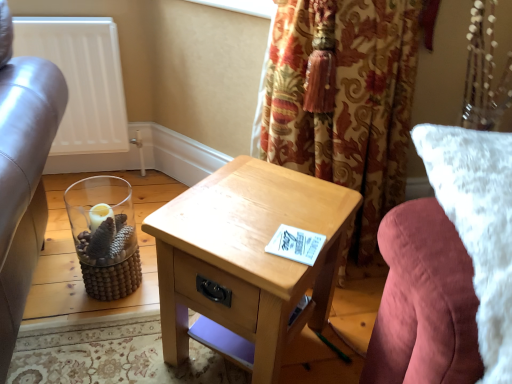
What are the coordinates of `clear glass vase at lower left` in the screenshot? It's located at (104, 235).

Identify the location of white matte radiator at upper left. (81, 79).

Find the location of a particular element. light wood/texture nightstand at center is located at coordinates (247, 257).

This screenshot has height=384, width=512. What do you see at coordinates (448, 267) in the screenshot?
I see `white fluffy pillow at right` at bounding box center [448, 267].

The height and width of the screenshot is (384, 512). Identify the location of clear glass vase at lower left. (104, 235).

Is light wood/texture nightstand at center aimed at clear glass vase at lower left?

No, light wood/texture nightstand at center is not turned towards clear glass vase at lower left.

Are light wood/texture nightstand at center and clear glass vase at lower left located far from each other?

No, light wood/texture nightstand at center is not far from clear glass vase at lower left.

From the image's perspective, relative to clear glass vase at lower left, is light wood/texture nightstand at center above or below?

Based on their image positions, light wood/texture nightstand at center is located beneath clear glass vase at lower left.

Between white matte radiator at upper left and clear glass vase at lower left, which one has less height?

clear glass vase at lower left.

Can you confirm if white matte radiator at upper left is bigger than clear glass vase at lower left?

Correct, white matte radiator at upper left is larger in size than clear glass vase at lower left.

Between white matte radiator at upper left and clear glass vase at lower left, which one is positioned in front?

clear glass vase at lower left is closer to the camera.

Is white matte radiator at upper left wider or thinner than clear glass vase at lower left?

In the image, white matte radiator at upper left appears to be more narrow than clear glass vase at lower left.

In the scene shown: Is clear glass vase at lower left next to white fluffy pillow at right and touching it?

No.

Considering the sizes of objects clear glass vase at lower left and white fluffy pillow at right in the image provided, who is bigger, clear glass vase at lower left or white fluffy pillow at right?

white fluffy pillow at right.

From the image's perspective, is clear glass vase at lower left located above or below white fluffy pillow at right?

clear glass vase at lower left is below white fluffy pillow at right.

Considering the relative sizes of clear glass vase at lower left and white fluffy pillow at right in the image provided, is clear glass vase at lower left wider than white fluffy pillow at right?

Incorrect, the width of clear glass vase at lower left does not surpass that of white fluffy pillow at right.

Is light wood/texture nightstand at center shorter than white matte radiator at upper left?

Yes.

Is the depth of light wood/texture nightstand at center greater than that of white matte radiator at upper left?

No, it is not.

Based on their positions, is light wood/texture nightstand at center located to the left or right of white matte radiator at upper left?

In the image, light wood/texture nightstand at center appears on the right side of white matte radiator at upper left.

Which is closer to the camera, (181, 233) or (105, 19)?

Point (181, 233)

Which is more to the right, clear glass vase at lower left or white matte radiator at upper left?

clear glass vase at lower left is more to the right.

Locate an element on the screen. The height and width of the screenshot is (384, 512). candle holder in front of the white matte radiator at upper left is located at coordinates (104, 235).

Considering the positions of objects clear glass vase at lower left and white matte radiator at upper left in the image provided, who is in front, clear glass vase at lower left or white matte radiator at upper left?

clear glass vase at lower left.

Is clear glass vase at lower left smaller than white matte radiator at upper left?

Yes.

Considering the relative sizes of white fluffy pillow at right and white matte radiator at upper left in the image provided, is white fluffy pillow at right wider than white matte radiator at upper left?

Yes.

From a real-world perspective, is white fluffy pillow at right on white matte radiator at upper left?

Correct, in the physical world, white fluffy pillow at right is higher than white matte radiator at upper left.

Is white fluffy pillow at right to the left of clear glass vase at lower left from the viewer's perspective?

No.

Would you say white fluffy pillow at right is inside or outside clear glass vase at lower left?

The correct answer is: outside.

Is clear glass vase at lower left at the back of white fluffy pillow at right?

No, clear glass vase at lower left is not at the back of white fluffy pillow at right.

Who is bigger, white fluffy pillow at right or clear glass vase at lower left?

white fluffy pillow at right is bigger.

The height and width of the screenshot is (384, 512). In order to click on candle holder below the light wood/texture nightstand at center (from a real-world perspective) in this screenshot , I will do `click(104, 235)`.

Locate an element on the screen. candle holder below the white matte radiator at upper left (from the image's perspective) is located at coordinates (104, 235).

Which object lies further to the anchor point light wood/texture nightstand at center, white fluffy pillow at right or white matte radiator at upper left?

white matte radiator at upper left is positioned further to the anchor light wood/texture nightstand at center.

Which object lies further to the anchor point light wood/texture nightstand at center, white fluffy pillow at right or clear glass vase at lower left?

clear glass vase at lower left lies further to light wood/texture nightstand at center than the other object.

From the image, which object appears to be farther from white matte radiator at upper left, light wood/texture nightstand at center or clear glass vase at lower left?

light wood/texture nightstand at center is further to white matte radiator at upper left.

Which object lies further to the anchor point white fluffy pillow at right, clear glass vase at lower left or light wood/texture nightstand at center?

clear glass vase at lower left lies further to white fluffy pillow at right than the other object.

From the image, which object appears to be nearer to white fluffy pillow at right, light wood/texture nightstand at center or white matte radiator at upper left?

light wood/texture nightstand at center is positioned closer to the anchor white fluffy pillow at right.

Looking at this image, estimate the real-world distances between objects in this image. Which object is further from light wood/texture nightstand at center, white matte radiator at upper left or clear glass vase at lower left?

The object further to light wood/texture nightstand at center is white matte radiator at upper left.

Which object lies further to the anchor point white matte radiator at upper left, white fluffy pillow at right or clear glass vase at lower left?

white fluffy pillow at right is positioned further to the anchor white matte radiator at upper left.

When comparing their distances from clear glass vase at lower left, does light wood/texture nightstand at center or white fluffy pillow at right seem further?

white fluffy pillow at right is positioned further to the anchor clear glass vase at lower left.

You are a GUI agent. You are given a task and a screenshot of the screen. Output one action in this format:
    pyautogui.click(x=<x>, y=<y>)
    Task: Click on the candle holder situated between white matte radiator at upper left and white fluffy pillow at right from left to right
    The height and width of the screenshot is (384, 512).
    Given the screenshot: What is the action you would take?
    pyautogui.click(x=104, y=235)

This screenshot has width=512, height=384. Find the location of `nightstand between clear glass vase at lower left and white fluffy pillow at right from left to right`. nightstand between clear glass vase at lower left and white fluffy pillow at right from left to right is located at coordinates (247, 257).

At what (x,y) coordinates should I click in order to perform the action: click on nightstand between white matte radiator at upper left and white fluffy pillow at right. Please return your answer as a coordinate pair (x, y). Looking at the image, I should click on (247, 257).

Identify the location of candle holder situated between white matte radiator at upper left and light wood/texture nightstand at center from left to right. This screenshot has height=384, width=512. (104, 235).